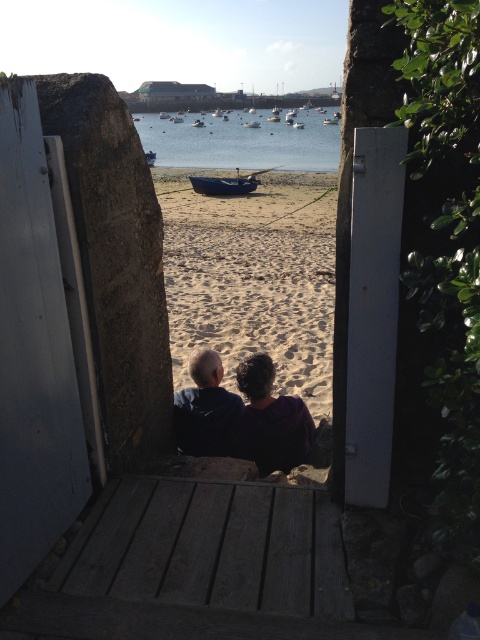
Question: Can you confirm if sandy beach at center is wider than dark blue hoodie at center?

Choices:
 (A) no
 (B) yes

Answer: (B)

Question: Does blue matte boat at center come behind white plastic boat at center?

Choices:
 (A) no
 (B) yes

Answer: (A)

Question: Among these points, which one is farthest from the camera?

Choices:
 (A) (191, 438)
 (B) (204, 145)

Answer: (B)

Question: Which point appears closest to the camera in this image?

Choices:
 (A) (182, 230)
 (B) (186, 403)

Answer: (B)

Question: Can you confirm if blue matte boat at center is smaller than blue wooden boat at center?

Choices:
 (A) yes
 (B) no

Answer: (A)

Question: Estimate the real-world distances between objects in this image. Which object is closer to the blue matte boat at center?

Choices:
 (A) blue wooden boat at center
 (B) sandy beach at center
 (C) white plastic boat at center

Answer: (B)